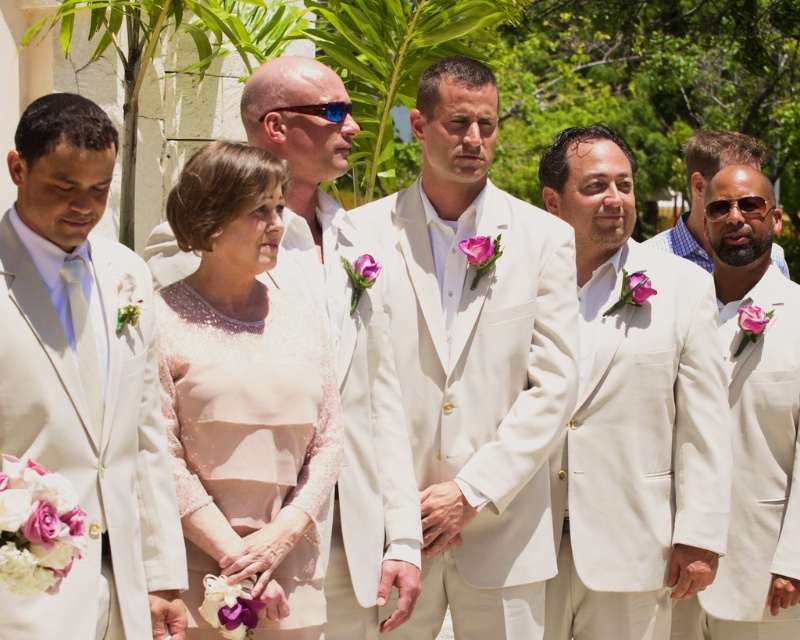
Is point (5, 340) closer to camera compared to point (798, 464)?

Yes, it is in front of point (798, 464).

Does matte white suit at left have a smaller size compared to white linen suit at right?

Yes, matte white suit at left is smaller than white linen suit at right.

Is point (110, 618) behind point (721, 320)?

No, (110, 618) is in front of (721, 320).

Image resolution: width=800 pixels, height=640 pixels. In order to click on matte white suit at left in this screenshot , I will do `click(84, 381)`.

Is matte white suit at left to the left of pearl lace dress at center from the viewer's perspective?

Yes, matte white suit at left is to the left of pearl lace dress at center.

Who is more distant from viewer, [152,582] or [272,406]?

The point [272,406] is more distant.

Locate an element on the screen. matte white suit at left is located at coordinates click(84, 381).

Does matte white suit at center appear on the left side of white satin suit at center?

In fact, matte white suit at center is to the right of white satin suit at center.

Between point (590, 188) and point (474, 536), which one is positioned in front?

Positioned in front is point (474, 536).

Find the location of `matte white suit at center`. matte white suit at center is located at coordinates (632, 412).